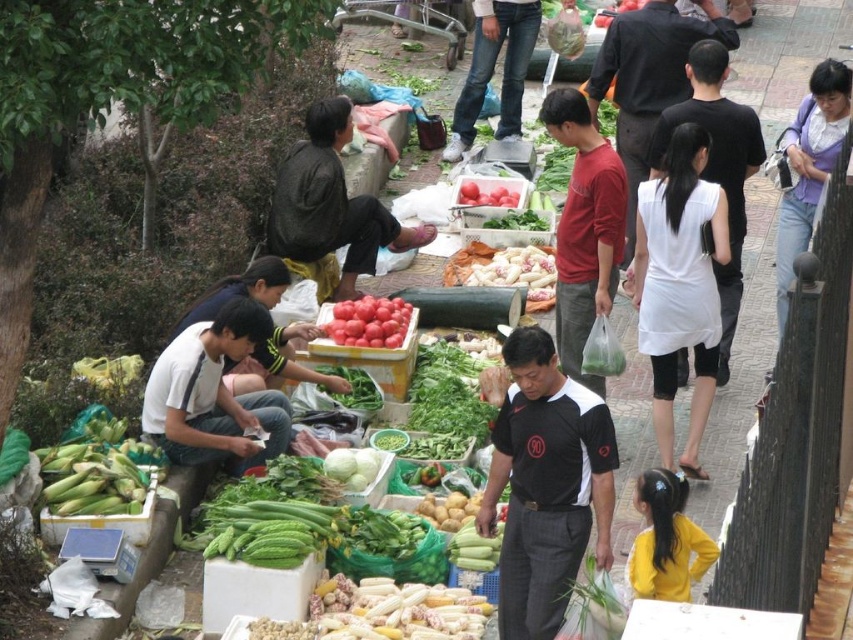
You are standing at the camera position and want to hand a paper to the person wearing the white cotton shirt at lower left. Can you reach them without moving from your current position?

The white cotton shirt at lower left is 28.48 feet away from camera, so you cannot reach them without moving from your current position.

You are standing at the center of the market and want to greet both the white cotton shirt at lower left and the yellow matte shirt at lower right. Which direction should you walk to first reach the closer one?

The white cotton shirt at lower left is 3.74 meters away from the yellow matte shirt at lower right. Since you are at the center, the distance to each would depend on their positions. However, without specific direction information, it is impossible to determine which is closer. Please provide more details about their positions relative to your location.

You are a customer at the market and see both the white cotton dress at center and the smooth red tomatoes at center. Which item is positioned to the right side of the other?

The white cotton dress at center is to the right of the smooth red tomatoes at center.